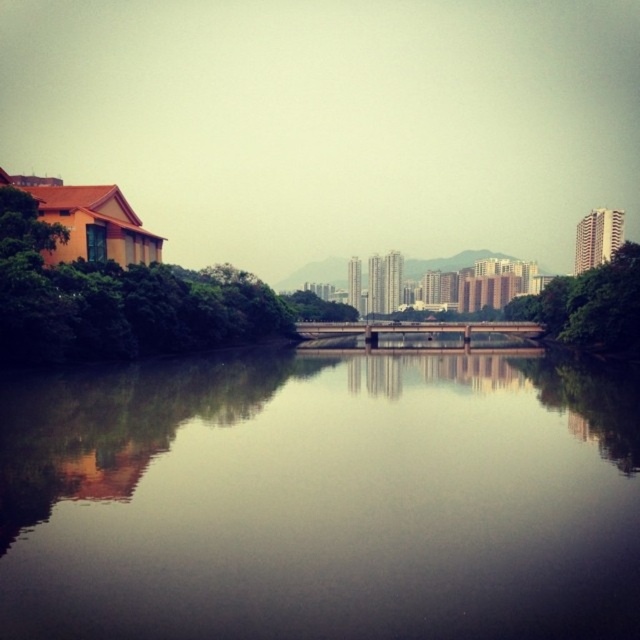
You are standing at the point marked by coordinates point (116, 301). What object are you closest to?

You are closest to the green leafy tree at left because the point (116, 301) represents the green leafy tree at left.

You are an urban planner analyzing the image. You need to determine which area takes up more space in the scene between the smooth reflective water at center and the green leafy tree at right. Which one occupies a larger portion of the image?

The green leafy tree at right occupies more space in the scene than the smooth reflective water at center according to the description.